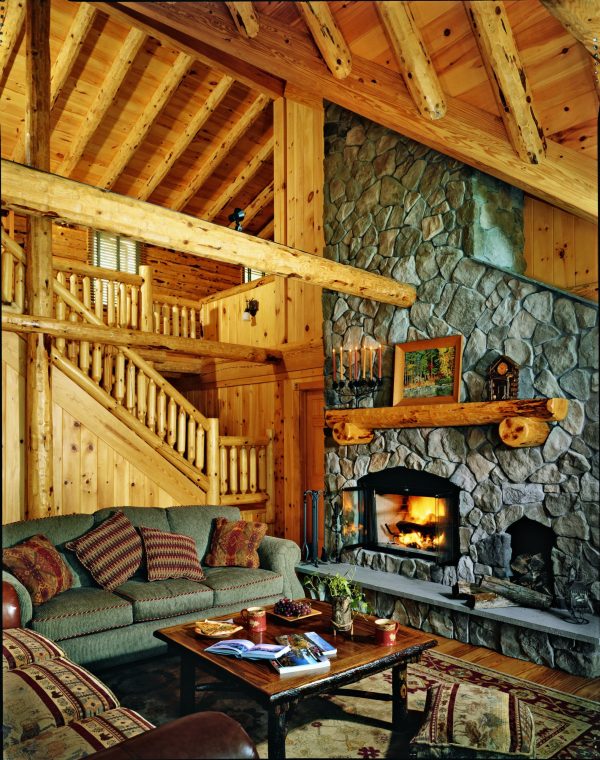
At what (x,y) coordinates should I click in order to perform the action: click on seat cushions of gray sofa. Please return your answer as a coordinate pair (x, y). Looking at the image, I should click on (72, 605), (143, 594), (234, 578).